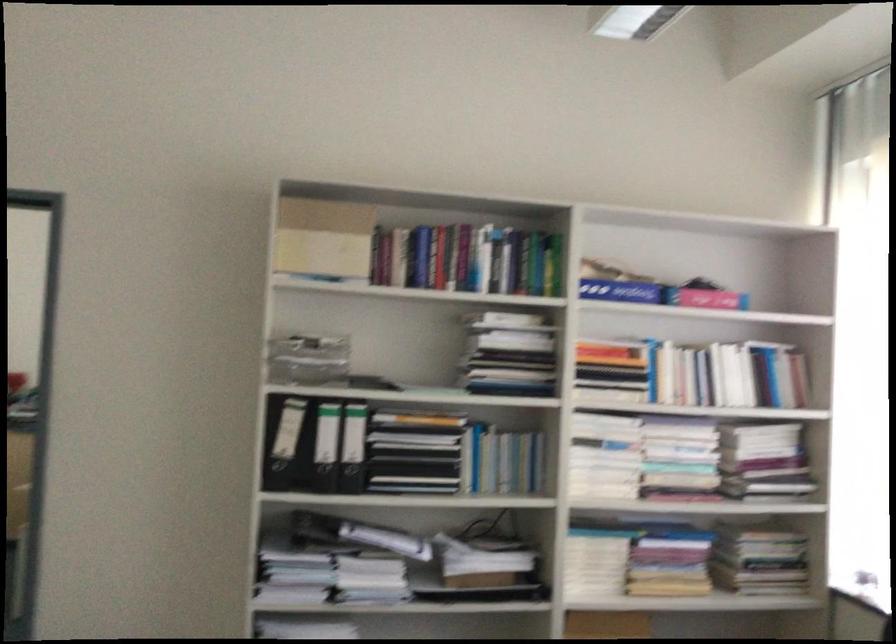
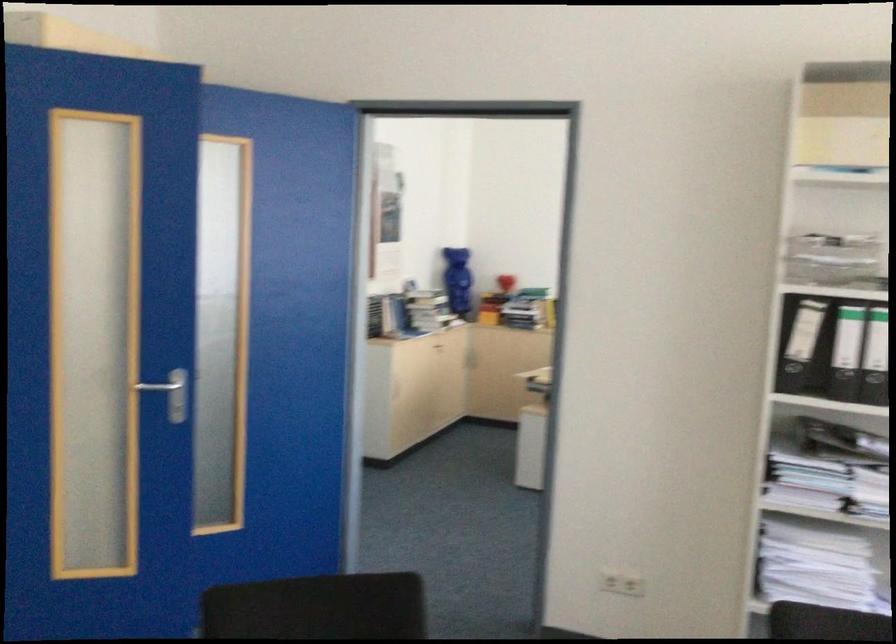
In the second image, find the point that corresponds to (x=280, y=444) in the first image.

(797, 343)